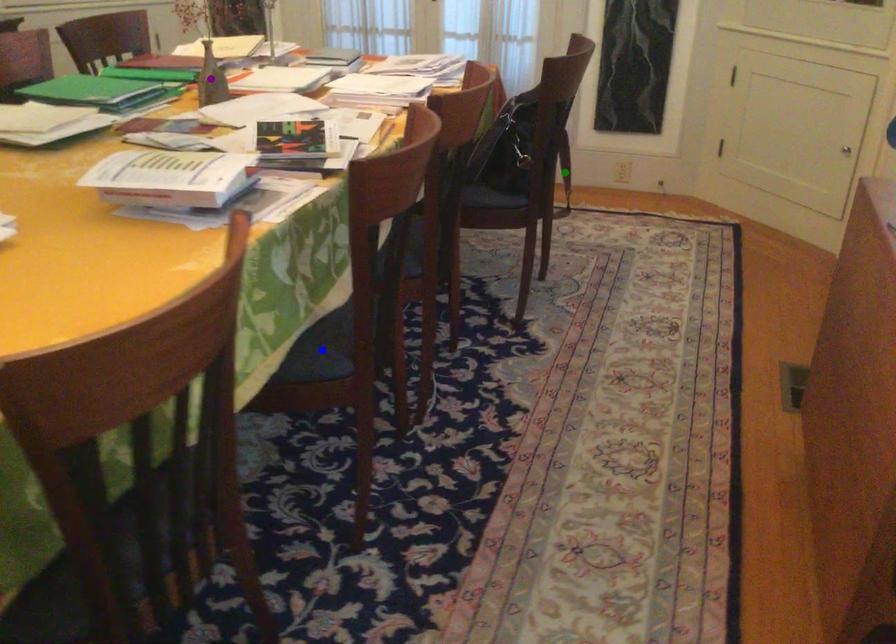
Order these from nearest to farthest:
purple point
green point
blue point

1. blue point
2. purple point
3. green point